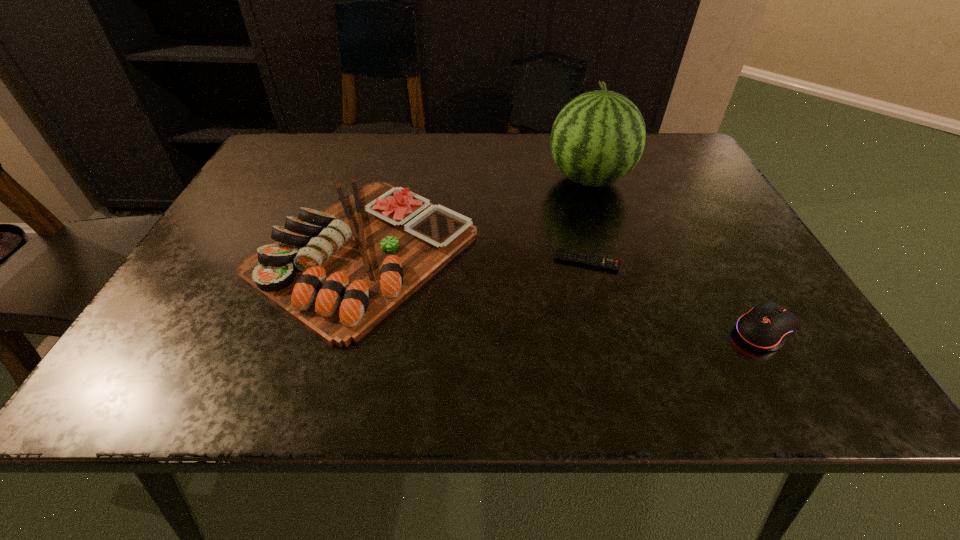
What are the coordinates of `object that is at the far edge` in the screenshot? It's located at (598, 137).

The height and width of the screenshot is (540, 960). I want to click on object at the near edge, so click(x=768, y=325).

Locate an element on the screen. The height and width of the screenshot is (540, 960). object that is positioned at the left edge is located at coordinates (339, 272).

Find the location of a particular element. The width and height of the screenshot is (960, 540). object situated at the right edge is located at coordinates (768, 325).

Find the location of a particular element. The height and width of the screenshot is (540, 960). object that is at the near right corner is located at coordinates coord(768,325).

This screenshot has width=960, height=540. I want to click on blank space at the far edge of the desktop, so click(348, 172).

Find the location of `free point at the near edge`. free point at the near edge is located at coordinates (638, 368).

Where is `vacant space at the right edge`? The height and width of the screenshot is (540, 960). vacant space at the right edge is located at coordinates (703, 203).

Image resolution: width=960 pixels, height=540 pixels. Identify the location of vacant region at the far right corner of the desktop. (x=698, y=177).

Locate an element on the screen. The height and width of the screenshot is (540, 960). vacant space at the near right corner is located at coordinates (840, 383).